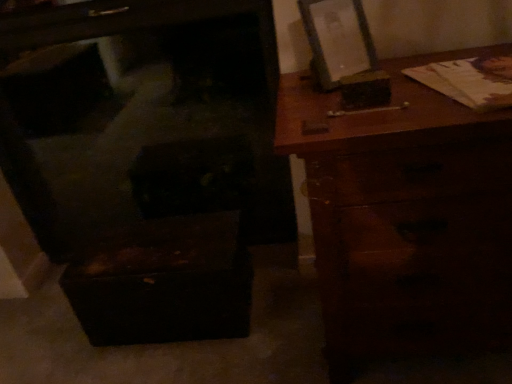
Question: In terms of height, does brown wooden chest of drawers at right look taller or shorter compared to wooden picture frame at upper right?

Choices:
 (A) short
 (B) tall

Answer: (B)

Question: From a real-world perspective, relative to wooden picture frame at upper right, is brown wooden chest of drawers at right vertically above or below?

Choices:
 (A) below
 (B) above

Answer: (A)

Question: Which object is positioned closest to the wooden picture frame at upper right?

Choices:
 (A) brown wooden chest of drawers at right
 (B) wooden chest at lower left

Answer: (A)

Question: Based on their relative distances, which object is farther from the brown wooden chest of drawers at right?

Choices:
 (A) wooden picture frame at upper right
 (B) wooden chest at lower left

Answer: (B)